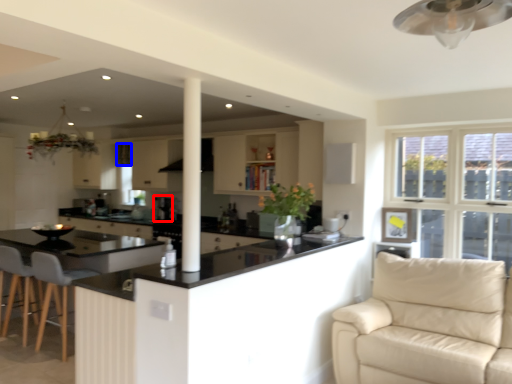
Question: Among these objects, which one is farthest to the camera, coffee machine (highlighted by a red box) or curtain (highlighted by a blue box)?

Choices:
 (A) coffee machine
 (B) curtain

Answer: (B)